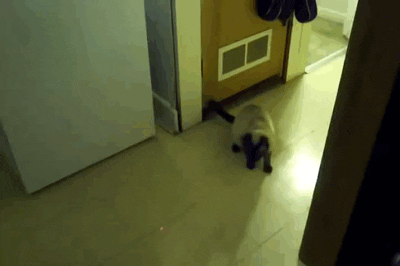
At what (x,y) coordinates should I click in order to perform the action: click on wooden closet door. Please return your answer as a coordinate pair (x, y). This screenshot has width=400, height=266. Looking at the image, I should click on (199, 21).